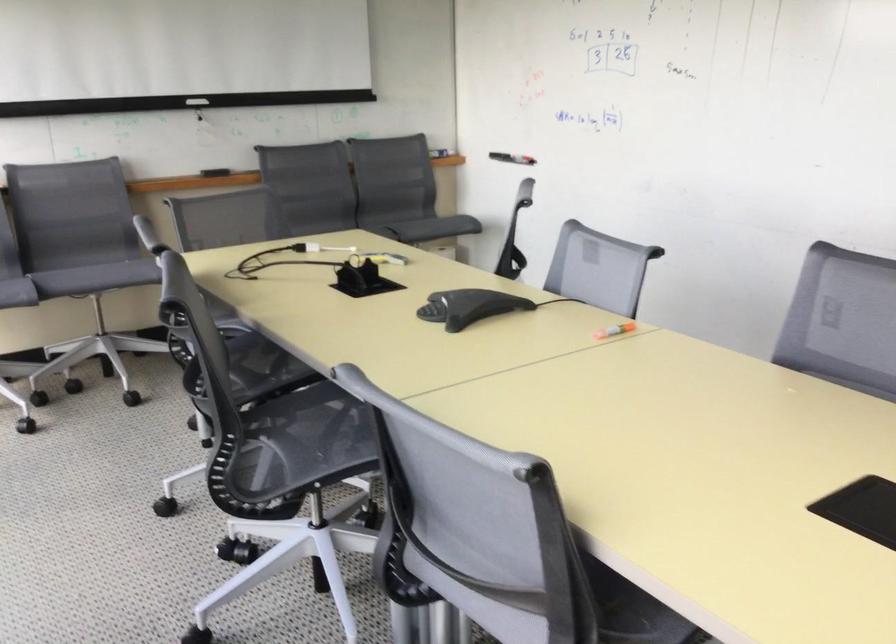
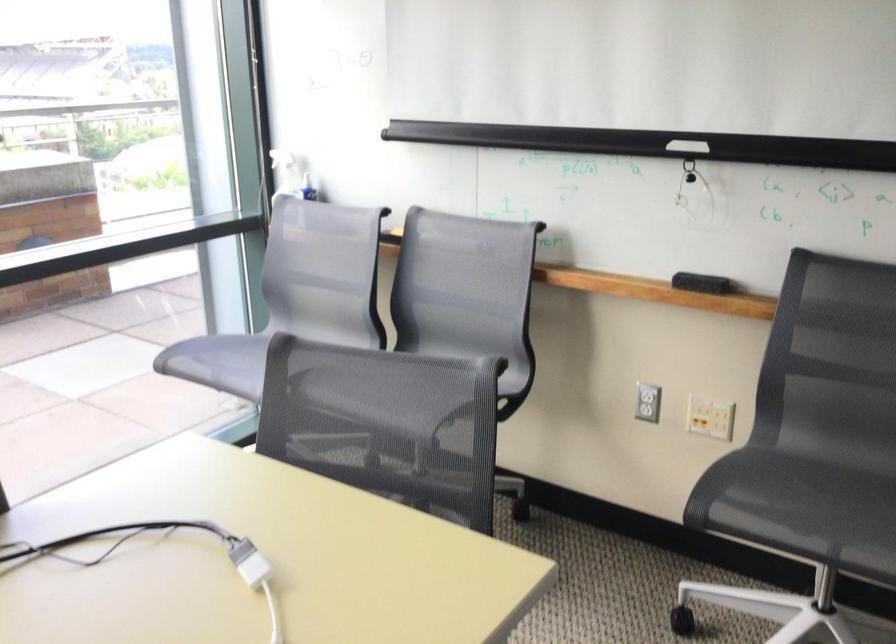
Where in the second image is the point corresponding to (x=212, y=167) from the first image?

(701, 283)